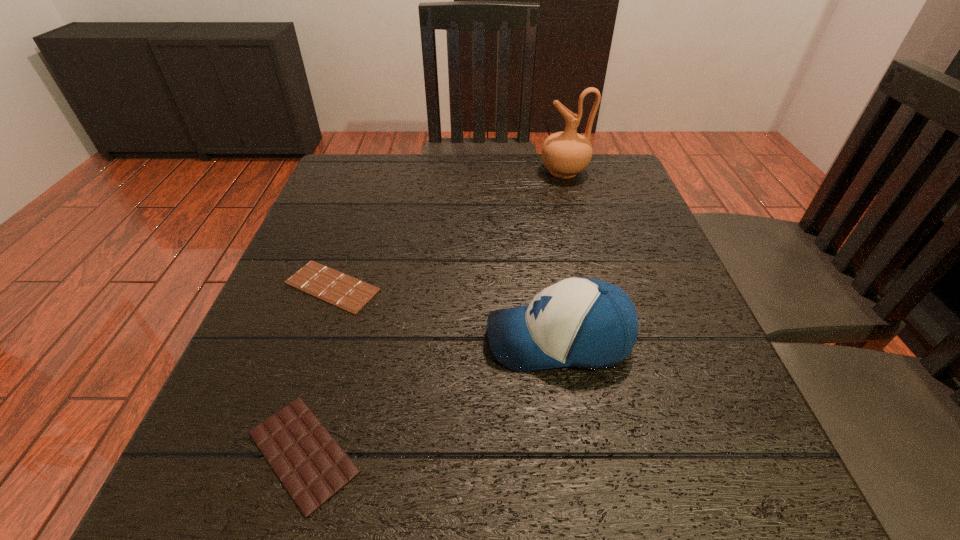
The image size is (960, 540). Identify the location of the tallest object. (565, 154).

The height and width of the screenshot is (540, 960). In order to click on the farthest object in this screenshot , I will do `click(565, 154)`.

I want to click on baseball cap, so click(587, 323).

Where is `the farther chocolate bar`? This screenshot has width=960, height=540. the farther chocolate bar is located at coordinates (341, 290).

Identify the location of the nearest object. This screenshot has height=540, width=960. (312, 466).

The image size is (960, 540). Find the location of `free region located on the spout of the farthest object`. free region located on the spout of the farthest object is located at coordinates (497, 171).

What are the coordinates of `free spot located on the spout of the farthest object` in the screenshot? It's located at (408, 171).

The image size is (960, 540). Identify the location of free region located on the spout of the farthest object. (459, 171).

Locate an element on the screen. This screenshot has width=960, height=540. vacant region located 0.340m on the front-facing side of the baseball cap is located at coordinates (283, 340).

Where is `vacant space located on the front-facing side of the baseball cap`? The height and width of the screenshot is (540, 960). vacant space located on the front-facing side of the baseball cap is located at coordinates (307, 340).